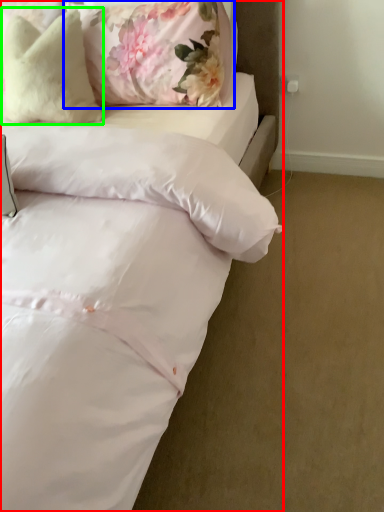
Question: Which is nearer to the bed (highlighted by a red box)? pillow (highlighted by a blue box) or pillow (highlighted by a green box).

Choices:
 (A) pillow
 (B) pillow

Answer: (A)